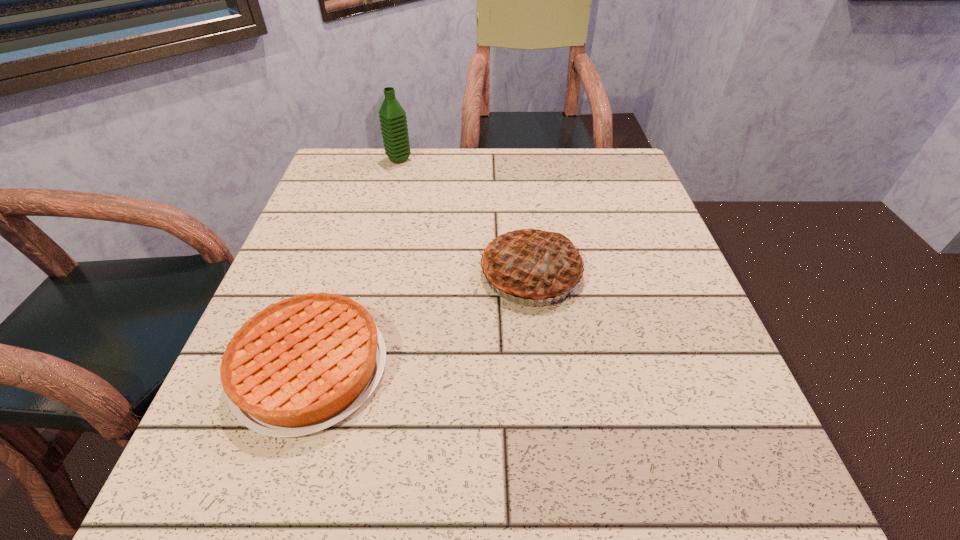
The image size is (960, 540). I want to click on vacant region between the right pie and the water bottle, so click(465, 216).

In order to click on free point between the farthest object and the shorter pie in this screenshot , I will do `click(354, 264)`.

Identify the location of blank region between the tallest object and the left pie. pos(354,264).

Locate an element on the screen. The width and height of the screenshot is (960, 540). vacant space that is in between the shortest object and the rightmost object is located at coordinates (420, 320).

Find the location of `free spot between the second shortest object and the left pie`. free spot between the second shortest object and the left pie is located at coordinates (420, 320).

Locate an element on the screen. This screenshot has height=540, width=960. vacant area that lies between the tallest object and the right pie is located at coordinates (465, 216).

What are the coordinates of `free space between the farthest object and the second tallest object` in the screenshot? It's located at (465, 216).

You are a GUI agent. You are given a task and a screenshot of the screen. Output one action in this format:
    pyautogui.click(x=<x>, y=<y>)
    Task: Click on the vacant space that's between the farthest object and the shortest object
    This screenshot has height=540, width=960.
    Given the screenshot: What is the action you would take?
    pyautogui.click(x=354, y=264)

Identify the location of free space between the rightmost object and the farthest object. The height and width of the screenshot is (540, 960). (465, 216).

Identify which object is located as the nearest to the left pie. Please provide its 2D coordinates. Your answer should be formatted as a tuple, i.e. [(x, y)], where the tuple contains the x and y coordinates of a point satisfying the conditions above.

[(531, 263)]